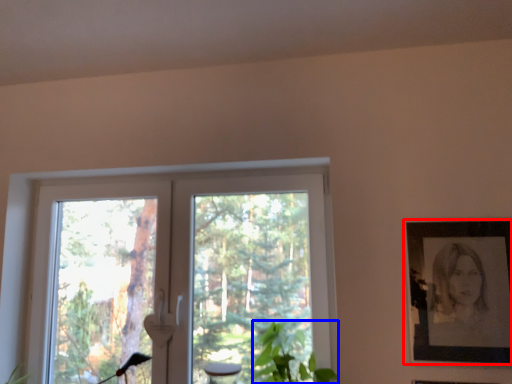
Question: Which object appears farthest to the camera in this image, picture frame (highlighted by a red box) or plant (highlighted by a blue box)?

Choices:
 (A) picture frame
 (B) plant

Answer: (A)